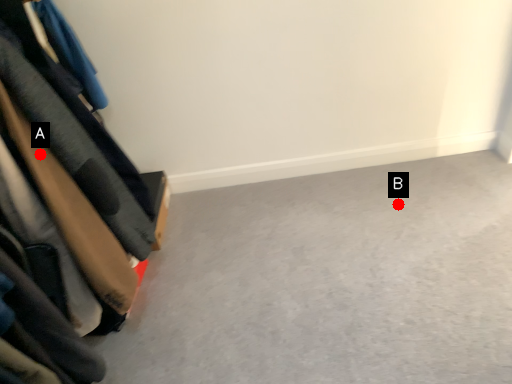
Question: Two points are circled on the image, labeled by A and B beside each circle. Which point is closer to the camera?

Choices:
 (A) A is closer
 (B) B is closer

Answer: (A)